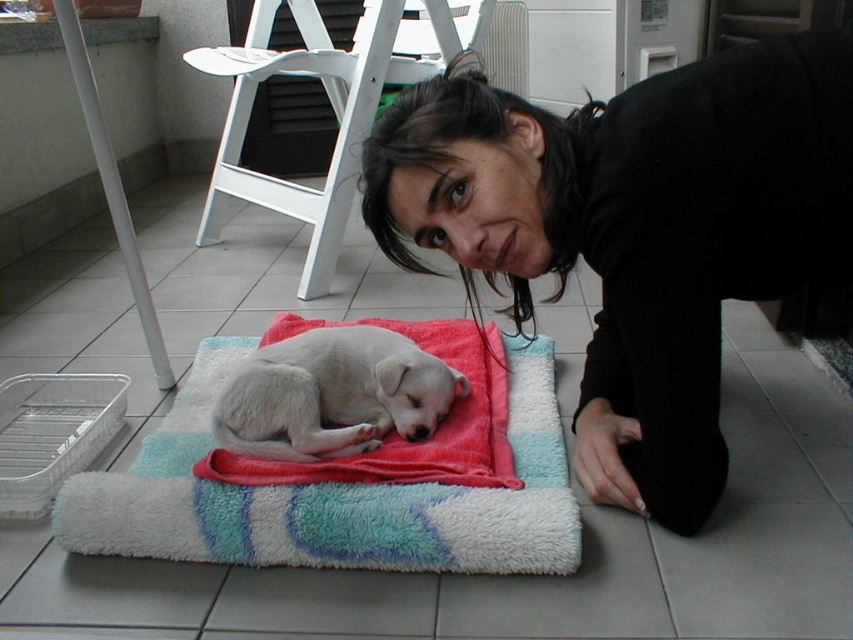
Measure the distance from soft multicolored rug at center to white fluffy dog at center.

soft multicolored rug at center and white fluffy dog at center are 4.79 inches apart.

The image size is (853, 640). What do you see at coordinates (350, 481) in the screenshot?
I see `soft multicolored rug at center` at bounding box center [350, 481].

Identify the location of soft multicolored rug at center. The height and width of the screenshot is (640, 853). (350, 481).

Does black fabric at center appear on the right side of white fluffy dog at center?

Yes, black fabric at center is to the right of white fluffy dog at center.

Does black fabric at center lie in front of white fluffy dog at center?

Yes.

Between point (676, 147) and point (273, 355), which one is positioned in front?

Point (676, 147) is more forward.

Locate an element on the screen. black fabric at center is located at coordinates tap(636, 230).

Who is lower down, black fabric at center or soft multicolored rug at center?

soft multicolored rug at center

Who is more forward, [424,164] or [526,536]?

Point [526,536]

Locate an element on the screen. This screenshot has height=640, width=853. black fabric at center is located at coordinates (636, 230).